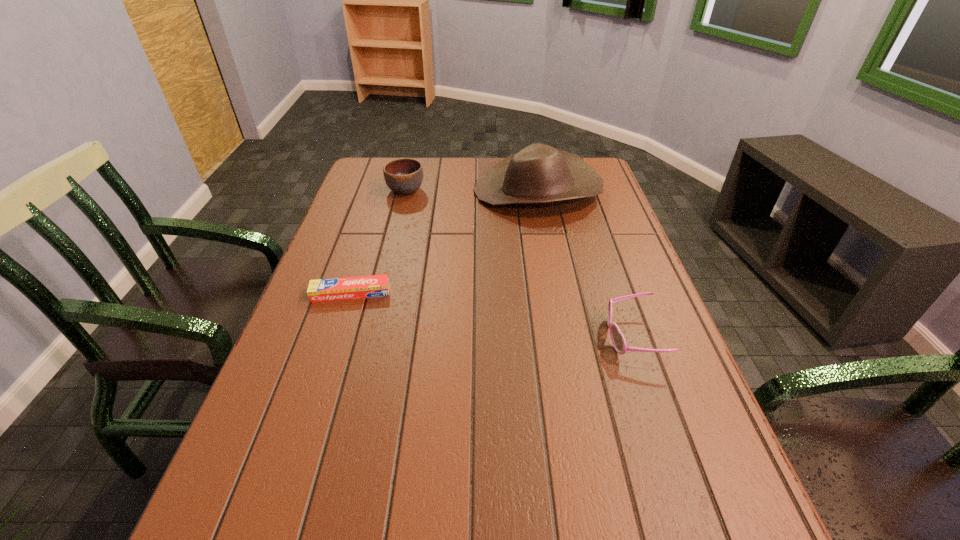
I want to click on free space at the far edge of the desktop, so click(x=482, y=158).

Where is `blank space at the left edge of the desktop`? blank space at the left edge of the desktop is located at coordinates (315, 461).

This screenshot has width=960, height=540. What are the coordinates of `vacant space at the right edge of the desktop` in the screenshot? It's located at (639, 333).

At what (x,y) coordinates should I click in order to perform the action: click on free space between the shortest object and the tallest object. Please return your answer as a coordinate pair (x, y). The height and width of the screenshot is (540, 960). Looking at the image, I should click on (444, 242).

I want to click on vacant space that is in between the cowboy hat and the sunglasses, so (585, 264).

Locate an element on the screen. Image resolution: width=960 pixels, height=540 pixels. vacant space that is in between the bowl and the shortest object is located at coordinates (378, 242).

You are a GUI agent. You are given a task and a screenshot of the screen. Output one action in this format:
    pyautogui.click(x=<x>, y=<y>)
    Task: Click on the blank region between the second tallest object and the sunglasses
    The image size is (960, 540).
    Given the screenshot: What is the action you would take?
    pyautogui.click(x=518, y=264)

This screenshot has width=960, height=540. Find the location of `vacant space that is in between the bowl and the cowboy hat`. vacant space that is in between the bowl and the cowboy hat is located at coordinates (471, 191).

Find the location of a particular element. free point between the third tallest object and the shortest object is located at coordinates (492, 315).

Where is `the closest object relative to the sunglasses`? This screenshot has height=540, width=960. the closest object relative to the sunglasses is located at coordinates (538, 174).